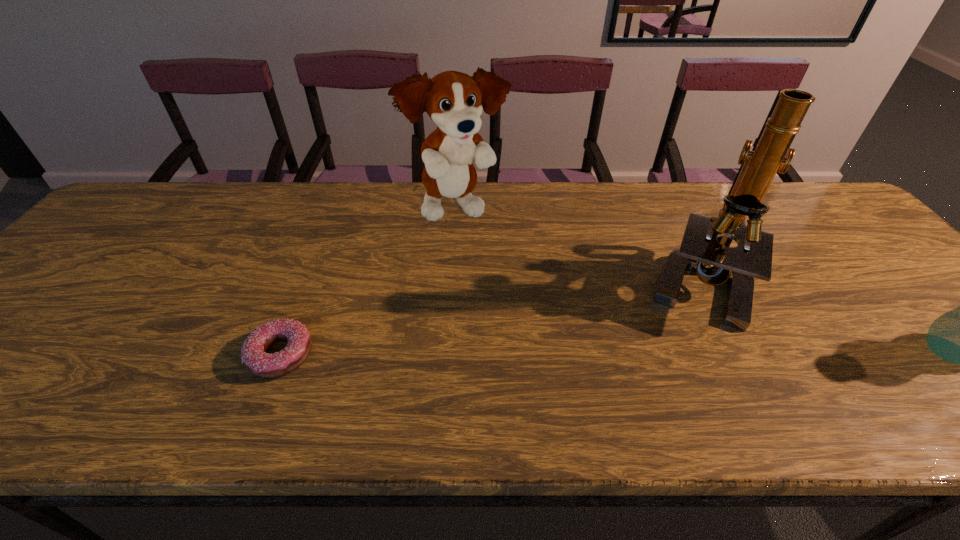
This screenshot has height=540, width=960. I want to click on the shortest object, so click(253, 352).

I want to click on the leftmost object, so click(253, 352).

Locate an element on the screen. The width and height of the screenshot is (960, 540). microscope is located at coordinates (705, 249).

Locate an element on the screen. puppy is located at coordinates (454, 101).

I want to click on the third object from right to left, so click(454, 101).

Where is `free location located 0.230m on the back of the shortest object`? free location located 0.230m on the back of the shortest object is located at coordinates click(x=318, y=261).

Find the location of a particular element. The width and height of the screenshot is (960, 540). vacant region located at the eyepiece of the second object from right to left is located at coordinates (632, 343).

Where is `free region located 0.300m at the eyepiece of the second object from right to left`? free region located 0.300m at the eyepiece of the second object from right to left is located at coordinates (583, 383).

Identify the location of vacant space situated at the eyepiece of the second object from right to left. (583, 383).

Identify the location of blank area located 0.250m on the face of the third shortest object. The height and width of the screenshot is (540, 960). (537, 288).